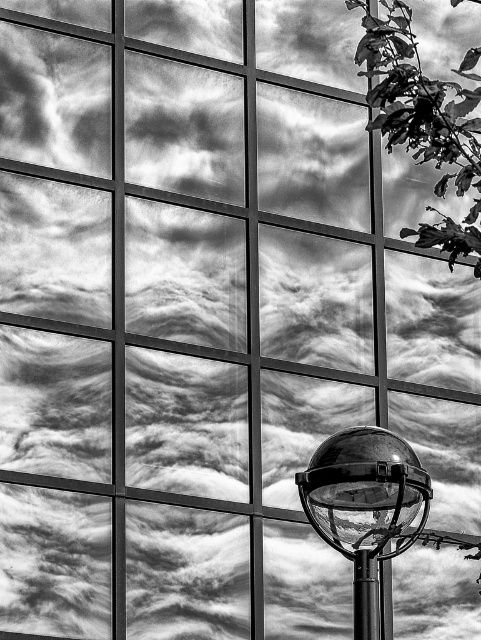
Question: Is polished glass globe at center positioned behind polished metal pole at lower right?

Choices:
 (A) no
 (B) yes

Answer: (A)

Question: Which of the following is the closest to the observer?

Choices:
 (A) polished glass globe at center
 (B) polished metal pole at lower right

Answer: (A)

Question: Does polished glass globe at center appear on the left side of polished metal pole at lower right?

Choices:
 (A) yes
 (B) no

Answer: (B)

Question: Which point is closer to the camera?

Choices:
 (A) (366, 513)
 (B) (354, 572)

Answer: (A)

Question: Can you confirm if polished glass globe at center is smaller than polished metal pole at lower right?

Choices:
 (A) no
 (B) yes

Answer: (A)